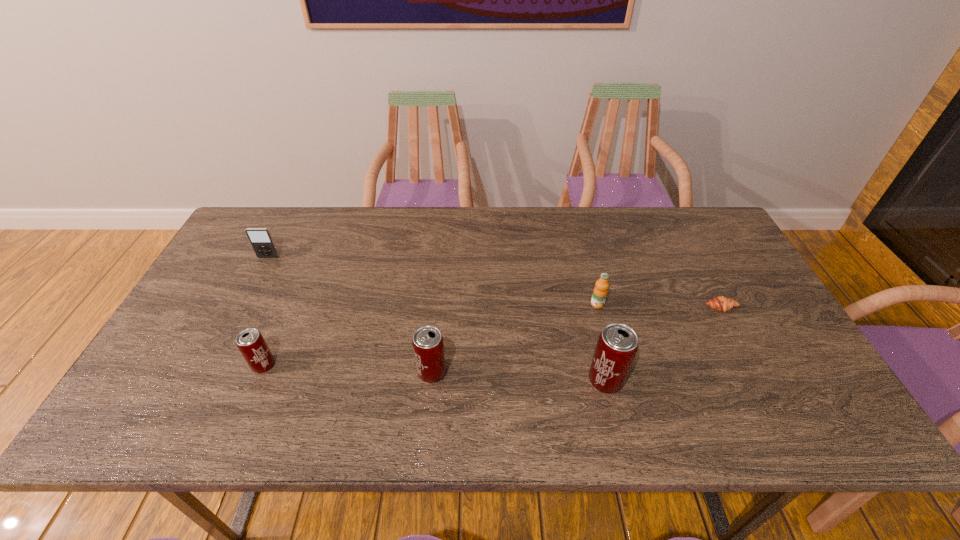
The width and height of the screenshot is (960, 540). I want to click on free space that is in between the farthest object and the tallest object, so click(437, 319).

Where is `unoccupied position between the orange juice and the iPod`? This screenshot has width=960, height=540. unoccupied position between the orange juice and the iPod is located at coordinates (433, 281).

Where is `free space between the iPod and the rightmost beer can`? The image size is (960, 540). free space between the iPod and the rightmost beer can is located at coordinates (437, 319).

Identify the location of object identified as the closest to the tallest object. click(600, 291).

Find the location of a particular element. The height and width of the screenshot is (540, 960). the third closest object relative to the farthest object is located at coordinates (600, 291).

The height and width of the screenshot is (540, 960). I want to click on beer can that is the closest to the rightmost beer can, so click(x=428, y=345).

Choose which beer can is the third nearest neighbor to the orange juice. Please provide its 2D coordinates. Your answer should be formatted as a tuple, i.e. [(x, y)], where the tuple contains the x and y coordinates of a point satisfying the conditions above.

[(250, 342)]

Image resolution: width=960 pixels, height=540 pixels. Find the location of `vacant space that satisfies the following two spatial constraints: 1. on the front-facing side of the shortest beer can; 2. on the right side of the farthest object`. vacant space that satisfies the following two spatial constraints: 1. on the front-facing side of the shortest beer can; 2. on the right side of the farthest object is located at coordinates (212, 365).

Image resolution: width=960 pixels, height=540 pixels. I want to click on free spot that satisfies the following two spatial constraints: 1. on the front-facing side of the iPod; 2. on the left side of the leftmost beer can, so click(x=212, y=365).

Where is `free space that satisfies the following two spatial constraints: 1. on the front-facing side of the farthest object; 2. on the left side of the fifth object from right to left`? The image size is (960, 540). free space that satisfies the following two spatial constraints: 1. on the front-facing side of the farthest object; 2. on the left side of the fifth object from right to left is located at coordinates (212, 365).